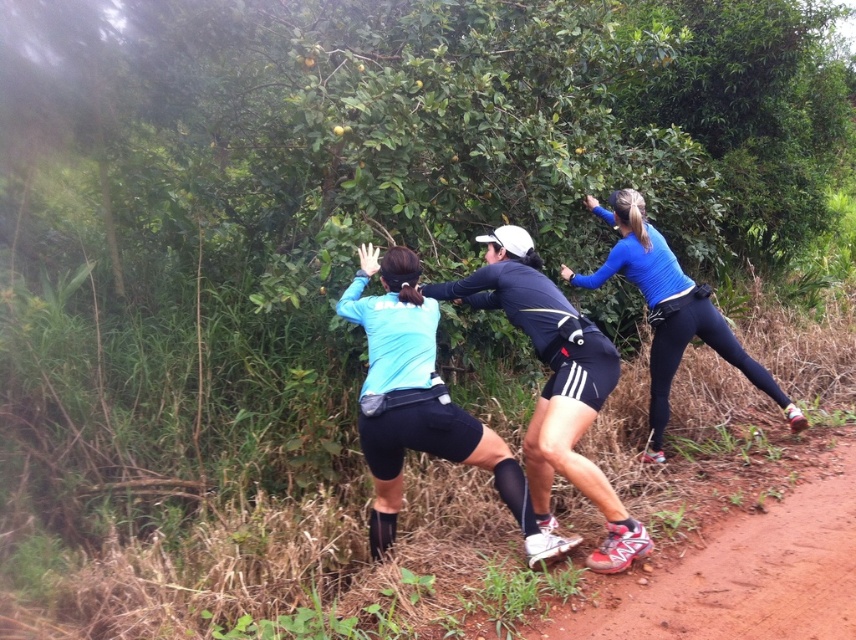
Between blue matte running top at center and blue matte shirt at center, which one appears on the right side from the viewer's perspective?

From the viewer's perspective, blue matte shirt at center appears more on the right side.

Is blue matte running top at center thinner than blue matte shirt at center?

Yes, blue matte running top at center is thinner than blue matte shirt at center.

At what (x,y) coordinates should I click in order to perform the action: click on blue matte running top at center. Please return your answer as a coordinate pair (x, y). Looking at the image, I should click on (420, 403).